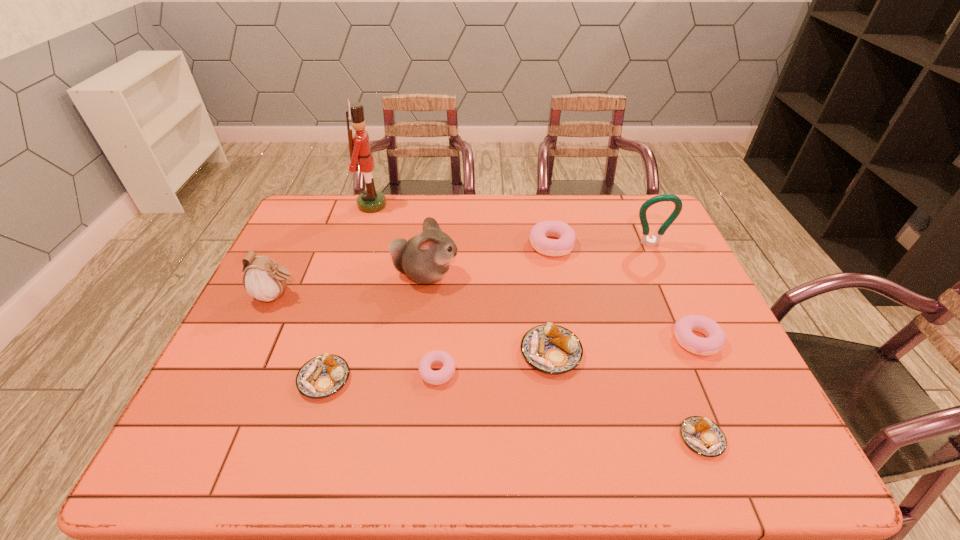
You are a GUI agent. You are given a task and a screenshot of the screen. Output one action in this format:
    pyautogui.click(x=<x>, y=<y>)
    Task: Click on the fifth closest pastry to the second smallest pink pastry
    The height and width of the screenshot is (540, 960).
    Given the screenshot: What is the action you would take?
    pyautogui.click(x=324, y=375)

Identify which pastry is the second nearest to the biggest brown pastry. Please provide its 2D coordinates. Your answer should be formatted as a tuple, i.e. [(x, y)], where the tuple contains the x and y coordinates of a point satisfying the conditions above.

[(703, 436)]

Locate an element on the screen. The width and height of the screenshot is (960, 540). pink pastry that can be found as the closest to the leftmost pink pastry is located at coordinates (566, 236).

Where is `pink pastry that is the nearest to the fifth pastry from right to left`? pink pastry that is the nearest to the fifth pastry from right to left is located at coordinates (566, 236).

Locate which brown pastry is the closest to the second smallest pink pastry. Please provide its 2D coordinates. Your answer should be formatted as a tuple, i.e. [(x, y)], where the tuple contains the x and y coordinates of a point satisfying the conditions above.

[(703, 436)]

Identify the location of brown pastry object that ranks as the third closest to the leftmost object. The width and height of the screenshot is (960, 540). [703, 436].

What are the coordinates of `vacant space that satisfies the following two spatial constraints: 1. on the back side of the smallest pink pastry; 2. on the face of the hamster` in the screenshot? It's located at (445, 274).

Identify the location of vacant region that satisfies the following two spatial constraints: 1. on the front-facing side of the leftmost pink pastry; 2. on the right side of the fourth tallest object. (241, 372).

The image size is (960, 540). Find the location of `free region that satisfies the following two spatial constraints: 1. at the jaws of the bottle opener; 2. on the face of the hamster`. free region that satisfies the following two spatial constraints: 1. at the jaws of the bottle opener; 2. on the face of the hamster is located at coordinates (664, 274).

Find the location of `vacant region that satisfies the following two spatial constraints: 1. on the front-facing side of the farthest object; 2. on the right side of the leftmost pastry`. vacant region that satisfies the following two spatial constraints: 1. on the front-facing side of the farthest object; 2. on the right side of the leftmost pastry is located at coordinates (317, 379).